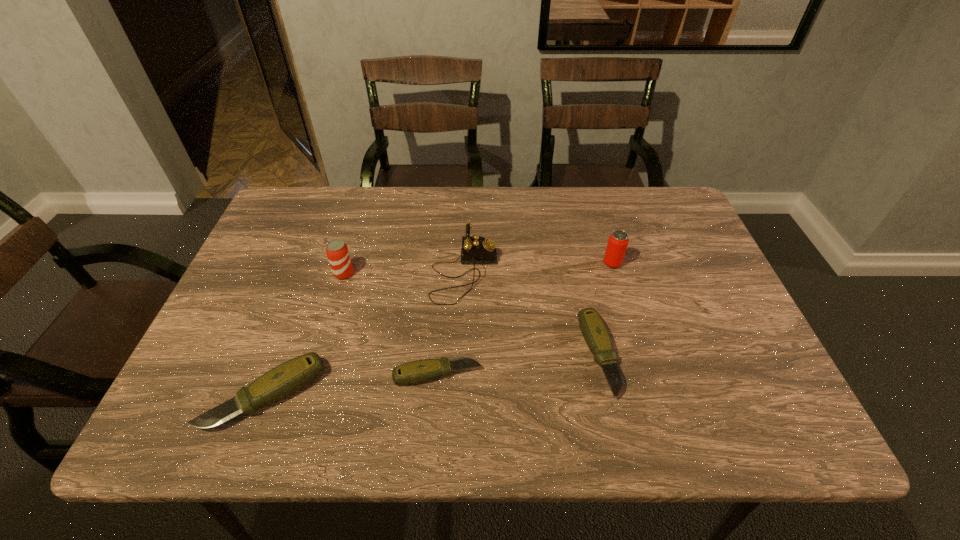
Please point a vacant point for placing a pocketknife on the right. Please provide its 2D coordinates. Your answer should be formatted as a tuple, i.e. [(x, y)], where the tuple contains the x and y coordinates of a point satisfying the conditions above.

[(750, 338)]